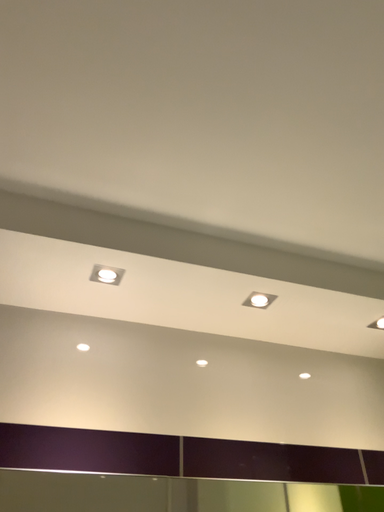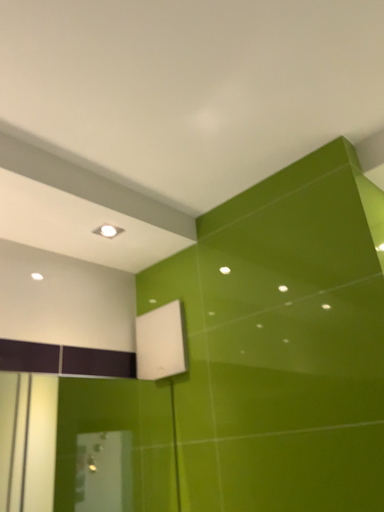
Question: Which way did the camera rotate in the video?

Choices:
 (A) rotated downward
 (B) rotated upward

Answer: (A)